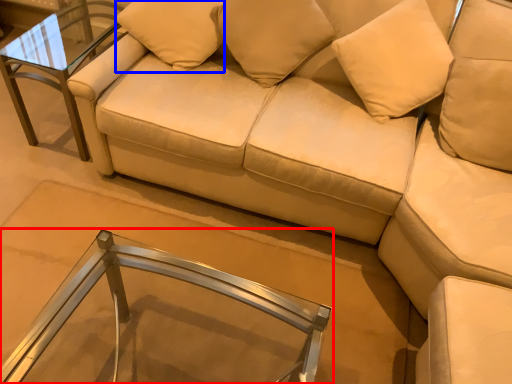
Question: Which object appears closest to the camera in this image, table (highlighted by a red box) or pillow (highlighted by a blue box)?

Choices:
 (A) table
 (B) pillow

Answer: (A)